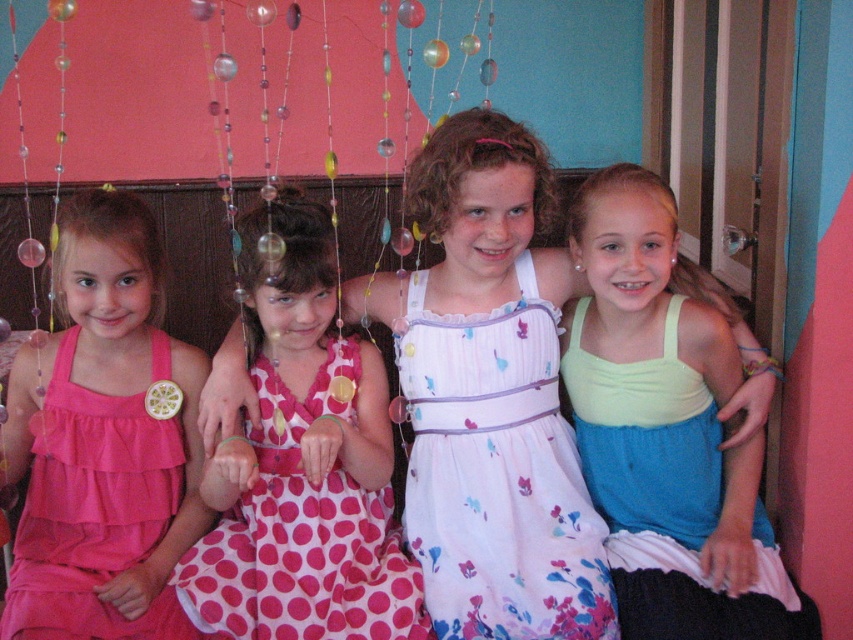
At what (x,y) coordinates should I click in order to perform the action: click on light green fabric dress at right. Please return your answer as a coordinate pair (x, y). Looking at the image, I should click on (666, 428).

Who is more forward, (x=670, y=406) or (x=111, y=499)?

Positioned in front is point (x=111, y=499).

Is point (712, 417) less distant than point (141, 444)?

That is False.

The width and height of the screenshot is (853, 640). What are the coordinates of `light green fabric dress at right` in the screenshot? It's located at (666, 428).

Is pink polka dot dress at center thinner than pink chiffon dress at left?

In fact, pink polka dot dress at center might be wider than pink chiffon dress at left.

Does point (263, 538) come in front of point (105, 408)?

Yes.

The height and width of the screenshot is (640, 853). I want to click on pink polka dot dress at center, so click(x=305, y=536).

Between point (509, 502) and point (283, 579), which one is positioned in front?

Point (283, 579) is in front.

From the picture: Does floral cotton dress at center appear on the right side of pink polka dot dress at center?

Correct, you'll find floral cotton dress at center to the right of pink polka dot dress at center.

Image resolution: width=853 pixels, height=640 pixels. I want to click on floral cotton dress at center, so click(x=497, y=474).